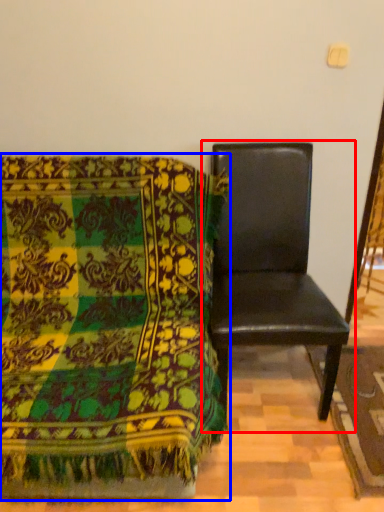
Question: Which of the following is the farthest to the observer, chair (highlighted by a red box) or chair (highlighted by a blue box)?

Choices:
 (A) chair
 (B) chair

Answer: (A)